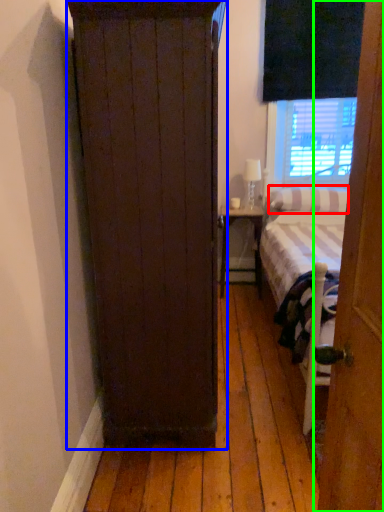
Question: Considering the real-world distances, which object is farthest from pillow (highlighted by a red box)? cupboard (highlighted by a blue box) or door (highlighted by a green box)?

Choices:
 (A) cupboard
 (B) door

Answer: (B)